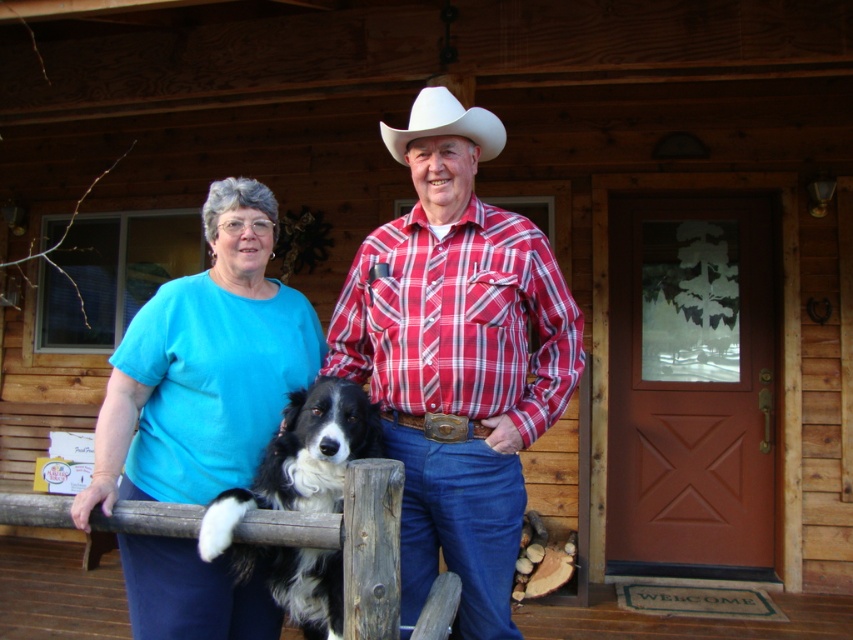
Question: Does black and white fur at center appear on the right side of white felt cowboy hat at center?

Choices:
 (A) yes
 (B) no

Answer: (B)

Question: Which object is the farthest from the matte blue shirt at center?

Choices:
 (A) red plaid shirt at center
 (B) white felt cowboy hat at center

Answer: (B)

Question: Based on their relative distances, which object is nearer to the red plaid shirt at center?

Choices:
 (A) matte blue shirt at center
 (B) black and white fur at center

Answer: (B)

Question: Is red plaid shirt at center further to the viewer compared to matte blue shirt at center?

Choices:
 (A) no
 (B) yes

Answer: (B)

Question: Is the position of matte blue shirt at center less distant than that of black and white fur at center?

Choices:
 (A) no
 (B) yes

Answer: (A)

Question: Which of the following is the closest to the observer?

Choices:
 (A) black and white fur at center
 (B) red plaid shirt at center
 (C) matte blue shirt at center

Answer: (A)